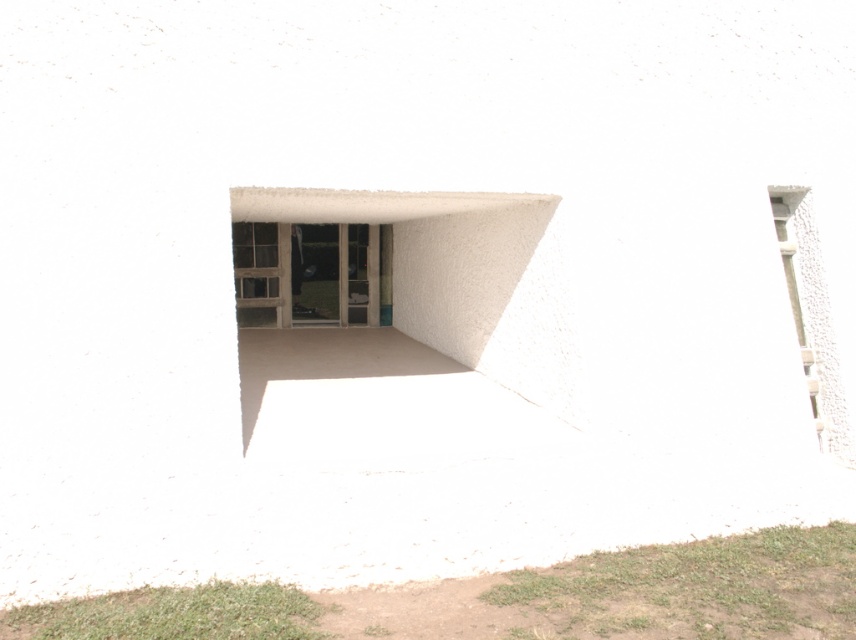
You are an architect inspecting the building exterior. You notice the transparent glass window at center and the smooth concrete window at right. Which window is located to the left of the other?

The transparent glass window at center is positioned on the left side of smooth concrete window at right.

You are standing in front of the building and want to enter through one of the windows. Which window is higher up, the transparent glass window at center or the smooth concrete window at right?

The transparent glass window at center is located above the smooth concrete window at right, so it is higher up.

You are an architect designing a new building and want to ensure that the transparent glass window at center and the smooth concrete window at right are appropriately sized. Based on the image, which window has a greater width?

The transparent glass window at center has a greater width than the smooth concrete window at right according to the description.